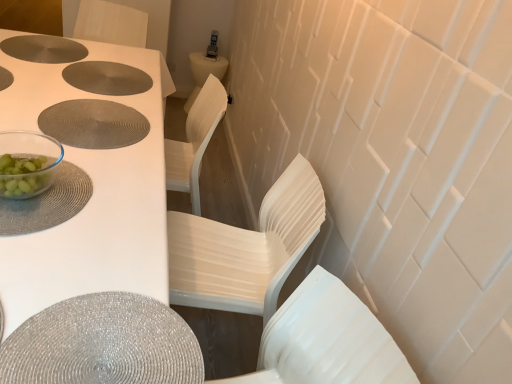
This screenshot has height=384, width=512. Identify the location of free space in front of matte gray placemat at upper left, which is counted as the second hole, starting from the top. (59, 94).